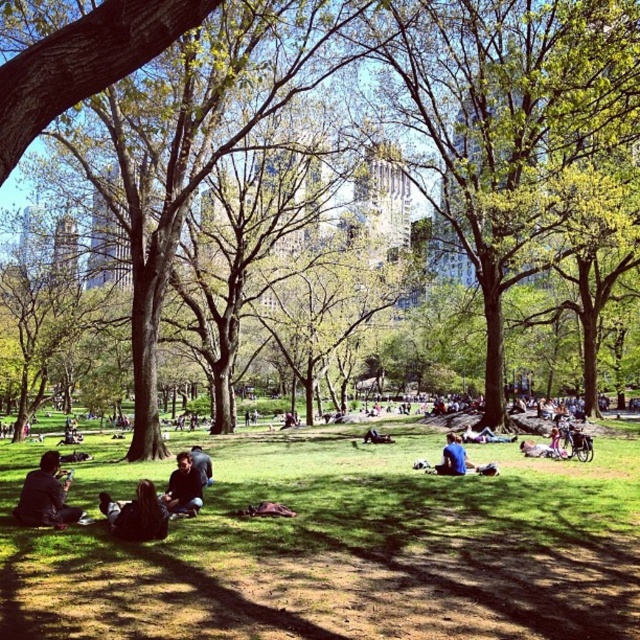
From the picture: Between green grass at center and dark blue jeans at center, which one is positioned higher?

dark blue jeans at center is higher up.

You are a GUI agent. You are given a task and a screenshot of the screen. Output one action in this format:
    pyautogui.click(x=<x>, y=<y>)
    Task: Click on the green grass at center
    Image resolution: width=640 pixels, height=640 pixels.
    Given the screenshot: What is the action you would take?
    pyautogui.click(x=348, y=548)

Does green leafy tree at center have a smaller size compared to blue fabric at lower center?

No.

Is point (346, 13) in front of point (456, 467)?

No.

The image size is (640, 640). What do you see at coordinates (506, 115) in the screenshot?
I see `green leafy tree at center` at bounding box center [506, 115].

This screenshot has height=640, width=640. Identify the location of green leafy tree at center. (506, 115).

Based on the photo, does green leafy tree at center have a larger size compared to dark blue shirt at center?

Yes.

Is point (560, 129) less distant than point (164, 499)?

No, it is behind (164, 499).

The height and width of the screenshot is (640, 640). What are the coordinates of `green leafy tree at center` in the screenshot? It's located at (506, 115).